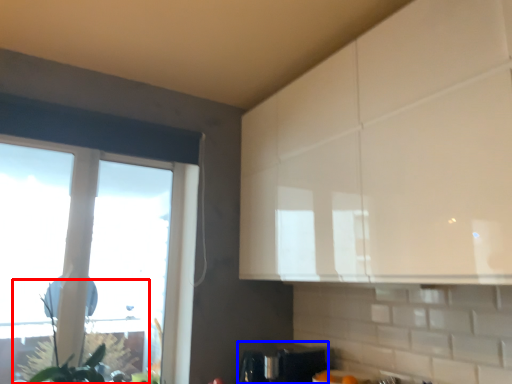
Question: Which of the following is the farthest to the observer, plant (highlighted by a red box) or appliance (highlighted by a blue box)?

Choices:
 (A) plant
 (B) appliance

Answer: (B)